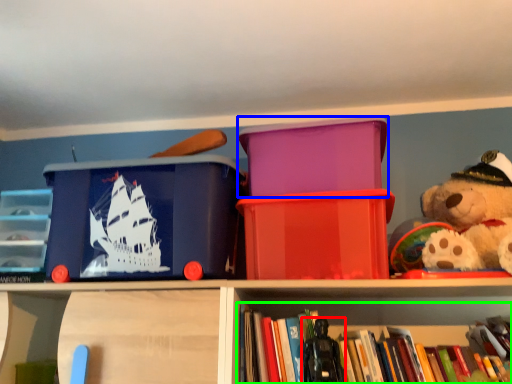
Question: Estimate the real-world distances between objects in this image. Which object is farther from toy (highlighted by a red box), storage box (highlighted by a blue box) or book (highlighted by a green box)?

Choices:
 (A) storage box
 (B) book

Answer: (A)